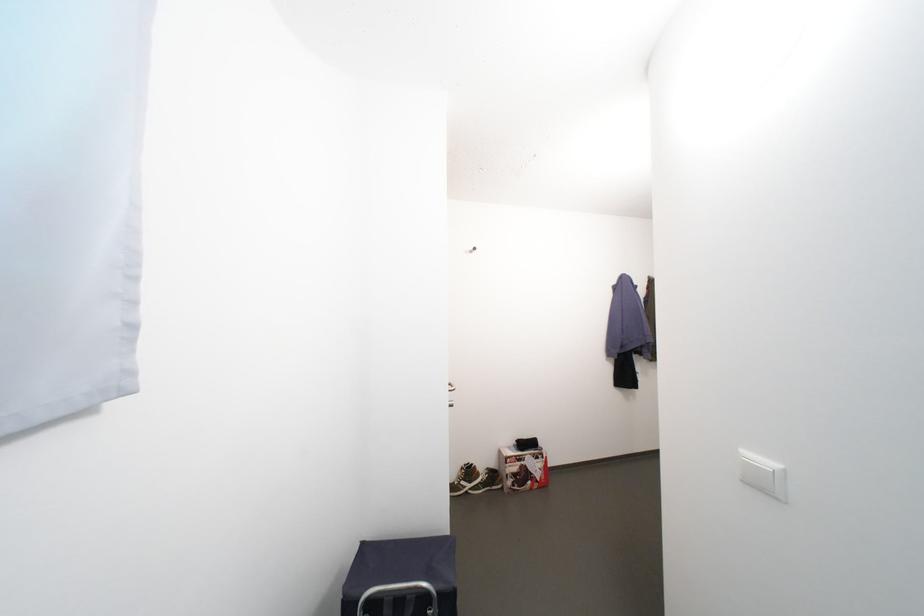
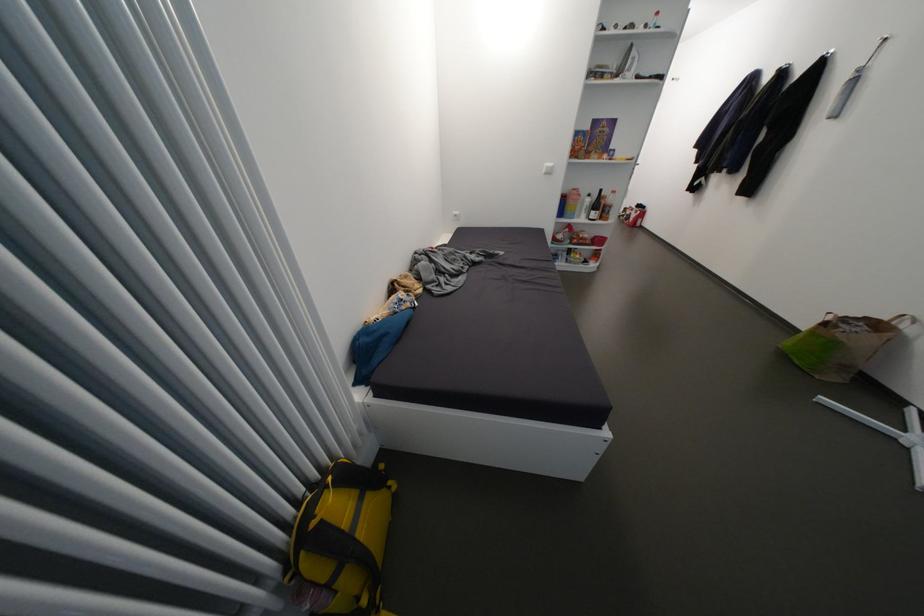
Find the pixel in the second image that matches point (544, 458) in the first image.

(642, 214)